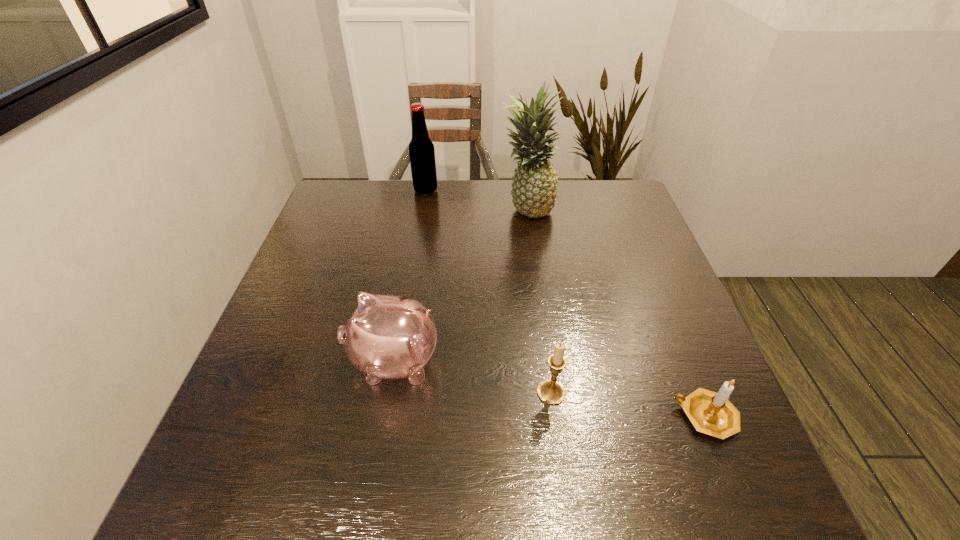
Where is `free space at the far right corner of the desktop`? This screenshot has width=960, height=540. free space at the far right corner of the desktop is located at coordinates (589, 211).

The width and height of the screenshot is (960, 540). In the image, there is a desktop. Identify the location of blank space at the near right corner. (719, 500).

In order to click on unoccupied area between the beer bottle and the tallest object in this screenshot , I will do `click(476, 200)`.

Locate an element on the screen. The image size is (960, 540). unoccupied position between the left candle holder and the beer bottle is located at coordinates (489, 292).

The height and width of the screenshot is (540, 960). I want to click on free space between the taller candle holder and the shorter candle holder, so click(629, 404).

Identify the location of vacant area that lies between the taller candle holder and the piggy bank. [x=472, y=377].

The width and height of the screenshot is (960, 540). In order to click on free space between the rightmost object and the beer bottle in this screenshot , I will do `click(565, 303)`.

Where is `empty space between the pineapple and the piggy bank`? empty space between the pineapple and the piggy bank is located at coordinates (461, 286).

I want to click on free area in between the tallest object and the piggy bank, so click(461, 286).

Locate an element on the screen. blank region between the shorter candle holder and the taller candle holder is located at coordinates (629, 404).